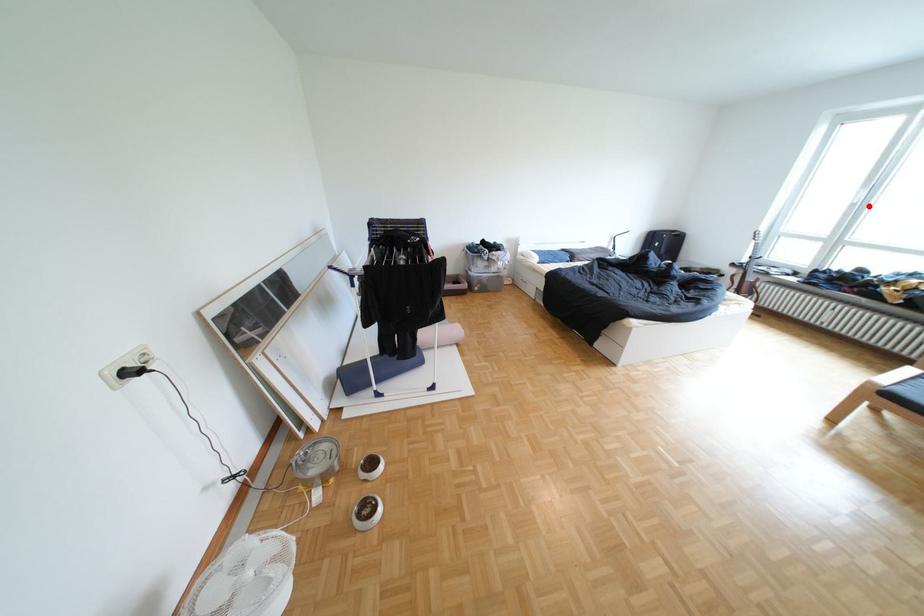
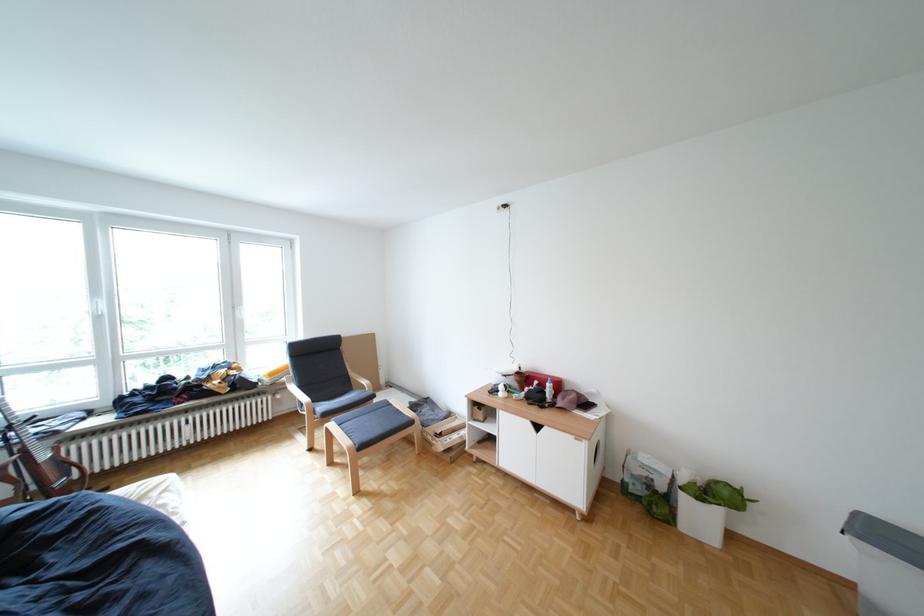
Question: A red point is marked in image1. In image2, is the corresponding 3D point closer to the camera or farther? Reply with the corresponding letter.

Choices:
 (A) The corresponding 3D point is closer.
 (B) The corresponding 3D point is farther.

Answer: (A)